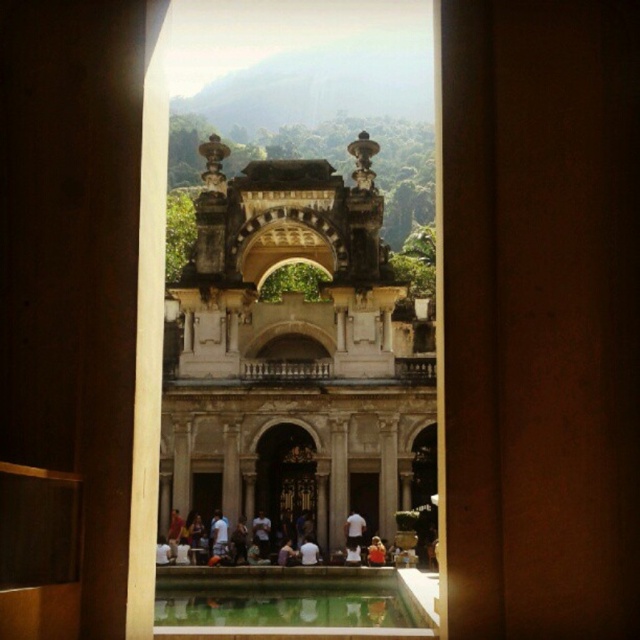
Question: Can you confirm if green polished stone pool at center is thinner than white matte shirt at center?

Choices:
 (A) no
 (B) yes

Answer: (A)

Question: Which point appears farthest from the camera in this image?

Choices:
 (A) (394, 584)
 (B) (273, 586)
 (C) (378, 512)

Answer: (C)

Question: Which of the following is the closest to the observer?

Choices:
 (A) white stone pillar at center
 (B) white matte shirt at center

Answer: (B)

Question: Is green polished stone pool at center thinner than light brown fabric shirt at center?

Choices:
 (A) no
 (B) yes

Answer: (A)

Question: Which point is closer to the camera?

Choices:
 (A) (380, 438)
 (B) (230, 593)

Answer: (B)

Question: Considering the relative positions of green polished stone pool at center and white stone pillar at center in the image provided, where is green polished stone pool at center located with respect to white stone pillar at center?

Choices:
 (A) below
 (B) above

Answer: (A)